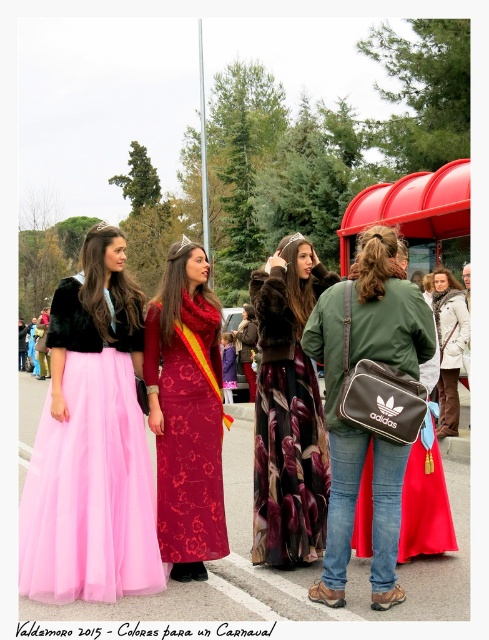
Is green fabric jacket at center below floral-patterned fur coat at center?

No.

Does point (378, 529) lie in front of point (286, 396)?

Yes, point (378, 529) is closer to viewer.

This screenshot has width=489, height=640. I want to click on green fabric jacket at center, so click(370, 404).

Is green fabric jacket at center below red plastic bus stop at center right?

Correct, green fabric jacket at center is located below red plastic bus stop at center right.

Between point (334, 525) and point (364, 512), which one is positioned in front?

Point (334, 525)

The height and width of the screenshot is (640, 489). Identify the location of green fabric jacket at center. (370, 404).

Between pink tulle skirt at left and white textured coat at center, which one is positioned higher?

white textured coat at center

Where is `pink tulle skirt at left`? The width and height of the screenshot is (489, 640). pink tulle skirt at left is located at coordinates (89, 492).

Between point (138, 416) and point (445, 410), which one is positioned behind?

Point (445, 410)

Find the location of `pink tulle skirt at left`. pink tulle skirt at left is located at coordinates (89, 492).